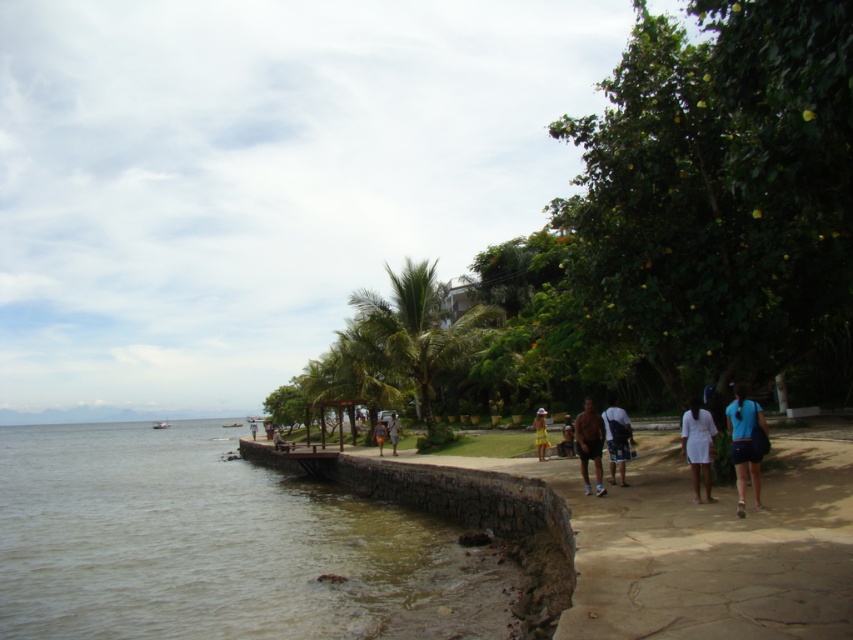
Is point (378, 445) behind point (251, 419)?

No, it is not.

Does tan fabric shorts at center appear under light blue fabric shirt at center?

No, tan fabric shorts at center is not below light blue fabric shirt at center.

Is point (376, 436) positioned in front of point (252, 417)?

Yes, point (376, 436) is closer to viewer.

Where is `tan fabric shorts at center`? The width and height of the screenshot is (853, 640). tan fabric shorts at center is located at coordinates (380, 435).

Does point (692, 472) lie in front of point (572, 432)?

Yes, point (692, 472) is in front of point (572, 432).

Is point (699, 433) positioned after point (566, 426)?

No, it is not.

This screenshot has height=640, width=853. Find the location of `white matte dress at lower right`. white matte dress at lower right is located at coordinates (698, 445).

Does blue fabric shorts at lower right have a smaller size compared to dark blue shorts at center?

No, blue fabric shorts at lower right is not smaller than dark blue shorts at center.

Is blue fabric shorts at lower right to the right of dark blue shorts at center from the viewer's perspective?

Yes, blue fabric shorts at lower right is to the right of dark blue shorts at center.

Measure the distance between blue fabric shorts at lower right and camera.

blue fabric shorts at lower right is 30.20 feet away from camera.

You are a GUI agent. You are given a task and a screenshot of the screen. Output one action in this format:
    pyautogui.click(x=<x>, y=<y>)
    Task: Click on the blue fabric shorts at lower right
    This screenshot has height=640, width=853.
    Given the screenshot: What is the action you would take?
    pyautogui.click(x=746, y=444)